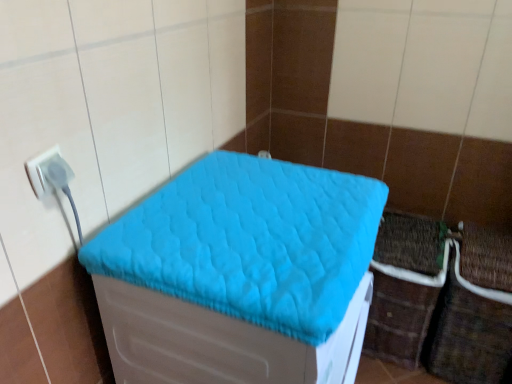
Find the location of a particular element. This screenshot has width=512, height=384. vacant region above turquoise quilted cushion at center (from a real-world perspective) is located at coordinates (260, 208).